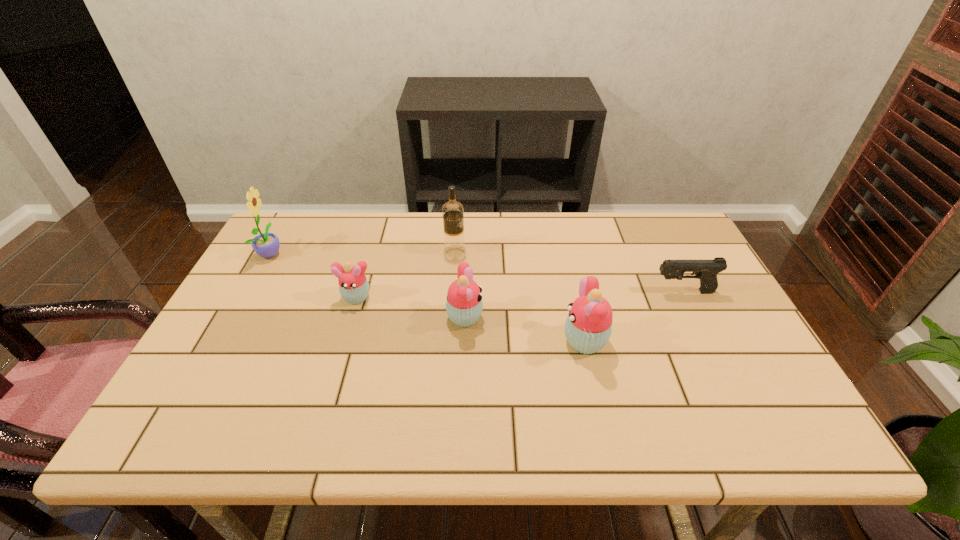
Where is `object that is positioned at the left edge`? This screenshot has width=960, height=540. object that is positioned at the left edge is located at coordinates (266, 245).

Find the location of `object at the right edge`. object at the right edge is located at coordinates (706, 270).

Identify the location of object located in the far left corner section of the desktop. (266, 245).

At what (x,y) coordinates should I click in order to perform the action: click on vacant space at the far edge of the desktop. Please return your answer as a coordinate pair (x, y). This screenshot has width=960, height=540. Looking at the image, I should click on click(526, 221).

In the image, there is a desktop. Find the location of `free space at the near edge`. free space at the near edge is located at coordinates (681, 376).

In order to click on vacant space at the left edge in this screenshot , I will do `click(252, 362)`.

Identify the location of vacant area at the right edge of the desktop. The width and height of the screenshot is (960, 540). (709, 309).

Where is `blank space at the far left corner`? blank space at the far left corner is located at coordinates (284, 214).

Identify the location of vacant area at the far right corner of the desktop. Image resolution: width=960 pixels, height=540 pixels. (682, 245).

Locate an element on the screen. unoccupied position between the rightmost object and the second object from right to left is located at coordinates (635, 316).